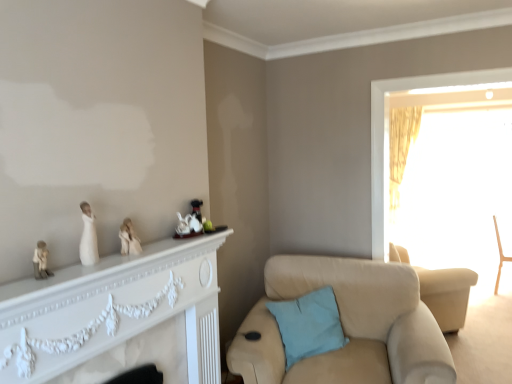
The width and height of the screenshot is (512, 384). Describe the element at coordinates (129, 239) in the screenshot. I see `white porcelain figurine at center, marked as the 1th person in a right-to-left arrangement` at that location.

This screenshot has width=512, height=384. What do you see at coordinates (347, 326) in the screenshot?
I see `beige fabric couch at lower right, positioned as the first chair in front-to-back order` at bounding box center [347, 326].

What do you see at coordinates (113, 310) in the screenshot? The image size is (512, 384). I see `white carved fireplace at upper left` at bounding box center [113, 310].

This screenshot has height=384, width=512. What do you see at coordinates (309, 325) in the screenshot? I see `light blue fabric pillow at lower center` at bounding box center [309, 325].

Describe the element at coordinates (41, 261) in the screenshot. The width and height of the screenshot is (512, 384). I see `white matte figurine at left, the third toy when ordered from back to front` at that location.

This screenshot has height=384, width=512. What do you see at coordinates (388, 137) in the screenshot?
I see `translucent yellow curtain at right` at bounding box center [388, 137].

In order to face translucent yellow curtain at right, should I rotate leftwards or rightwards?

Rotate your view right by about 23.419°.

The width and height of the screenshot is (512, 384). In order to click on white porcelain figurine at center, placed as the 1th person when sorted from back to front in this screenshot , I will do `click(129, 239)`.

Is beige fabric couch at lower right, which is the 2th chair in right-to-left order, oriented away from white carved fireplace at upper left?

No, beige fabric couch at lower right, which is the 2th chair in right-to-left order, is not facing the opposite direction of white carved fireplace at upper left.

Does beige fabric couch at lower right, which is the 2th chair in right-to-left order, lie in front of white carved fireplace at upper left?

No, beige fabric couch at lower right, which is the 2th chair in right-to-left order, is behind white carved fireplace at upper left.

Is beige fabric couch at lower right, placed as the 1th chair when sorted from left to right, surrounding white carved fireplace at upper left?

No, white carved fireplace at upper left is not surrounded by beige fabric couch at lower right, placed as the 1th chair when sorted from left to right.

Is beige fabric couch at lower right, which is the 2th chair in right-to-left order, wider than white carved fireplace at upper left?

Yes.

Can you tell me how much white porcelain figurine at center, marked as the 1th person in a right-to-left arrangement, and light blue fabric pillow at lower center differ in facing direction?

The angular difference between white porcelain figurine at center, marked as the 1th person in a right-to-left arrangement, and light blue fabric pillow at lower center is 40.7 degrees.

Is white porcelain figurine at center, marked as the 1th person in a right-to-left arrangement, placed right next to light blue fabric pillow at lower center?

No, white porcelain figurine at center, marked as the 1th person in a right-to-left arrangement, is not in contact with light blue fabric pillow at lower center.

Consider the image. Does white porcelain figurine at center, which is counted as the second person, starting from the left, appear on the right side of light blue fabric pillow at lower center?

In fact, white porcelain figurine at center, which is counted as the second person, starting from the left, is to the left of light blue fabric pillow at lower center.

From the picture: Choose the correct answer: Is light blue fabric pillow at lower center inside beige fabric couch at lower right, placed as the 1th chair when sorted from left to right, or outside it?

light blue fabric pillow at lower center fits inside beige fabric couch at lower right, placed as the 1th chair when sorted from left to right.

Is light blue fabric pillow at lower center wider than beige fabric couch at lower right, placed as the 1th chair when sorted from left to right?

No.

Can you confirm if light blue fabric pillow at lower center is bigger than beige fabric couch at lower right, positioned as the 2th chair in back-to-front order?

No, light blue fabric pillow at lower center is not bigger than beige fabric couch at lower right, positioned as the 2th chair in back-to-front order.

Does point (341, 336) come farther from viewer compared to point (364, 312)?

No, it is in front of (364, 312).

Can you tell me how much translucent yellow curtain at right and beige fabric couch at lower right, which is the 2th chair in right-to-left order, differ in facing direction?

There is a 15.8-degree angle between the facing directions of translucent yellow curtain at right and beige fabric couch at lower right, which is the 2th chair in right-to-left order.

Which is less distant, [373,255] or [270,337]?

Clearly, point [373,255] is more distant from the camera than point [270,337].

From a real-world perspective, which is physically above, translucent yellow curtain at right or beige fabric couch at lower right, positioned as the 2th chair in back-to-front order?

translucent yellow curtain at right is physically above.

Is translucent yellow curtain at right taller than beige fabric couch at lower right, positioned as the 2th chair in back-to-front order?

Indeed, translucent yellow curtain at right has a greater height compared to beige fabric couch at lower right, positioned as the 2th chair in back-to-front order.

Is translucent yellow curtain at right located outside gold textured curtain at right?

Yes, translucent yellow curtain at right is located beyond the bounds of gold textured curtain at right.

Between translucent yellow curtain at right and gold textured curtain at right, which one is positioned behind?

gold textured curtain at right is more distant.

Considering the points (497, 241) and (383, 236), which point is in front, point (497, 241) or point (383, 236)?

Point (383, 236)

Is the depth of wooden chair at right, placed as the 1th chair when sorted from right to left, less than that of translucent yellow curtain at right?

No.

Who is shorter, wooden chair at right, placed as the 1th chair when sorted from right to left, or translucent yellow curtain at right?

wooden chair at right, placed as the 1th chair when sorted from right to left.

Is translucent yellow curtain at right not inside white matte figurine at left, the third toy when ordered from back to front?

Yes.

Considering the relative sizes of translucent yellow curtain at right and white matte figurine at left, placed as the first toy when sorted from front to back, in the image provided, is translucent yellow curtain at right shorter than white matte figurine at left, placed as the first toy when sorted from front to back,?

No, translucent yellow curtain at right is not shorter than white matte figurine at left, placed as the first toy when sorted from front to back.

Considering the sizes of objects translucent yellow curtain at right and white matte figurine at left, placed as the first toy when sorted from front to back, in the image provided, who is smaller, translucent yellow curtain at right or white matte figurine at left, placed as the first toy when sorted from front to back,?

With smaller size is white matte figurine at left, placed as the first toy when sorted from front to back.

Locate an element on the screen. The height and width of the screenshot is (384, 512). dresser that appears in front of the beige fabric couch at lower right, which is the 2th chair in right-to-left order is located at coordinates (113, 310).

The height and width of the screenshot is (384, 512). I want to click on pillow to the right of white porcelain figurine at center, which is the second person in front-to-back order, so click(x=309, y=325).

Consider the image. Estimate the real-world distances between objects in this image. Which object is closer to translucent yellow curtain at right, wooden chair at right, placed as the 1th chair when sorted from right to left, or white porcelain figurine at center, which is counted as the second person, starting from the left?

white porcelain figurine at center, which is counted as the second person, starting from the left, is positioned closer to the anchor translucent yellow curtain at right.

Looking at the image, which one is located closer to light blue fabric pillow at lower center, white porcelain figurine at center, which is counted as the second person, starting from the left, or gold textured curtain at right?

white porcelain figurine at center, which is counted as the second person, starting from the left, lies closer to light blue fabric pillow at lower center than the other object.

Estimate the real-world distances between objects in this image. Which object is closer to white porcelain teapot at center, which is counted as the 2th toy, starting from the back, beige fabric couch at lower right, positioned as the 2th chair in back-to-front order, or white matte figurine at left, marked as the 1th toy in a left-to-right arrangement?

The object closer to white porcelain teapot at center, which is counted as the 2th toy, starting from the back, is white matte figurine at left, marked as the 1th toy in a left-to-right arrangement.

Estimate the real-world distances between objects in this image. Which object is further from white matte figurine at left, the third toy when ordered from back to front, white porcelain figurine at left, which appears as the first person when viewed from the left, or wooden chair at right, placed as the first chair when sorted from back to front?

wooden chair at right, placed as the first chair when sorted from back to front.

When comparing their distances from gold textured curtain at right, does white carved fireplace at upper left or white porcelain figurine at center, which is the second person in front-to-back order, seem closer?

Among the two, white carved fireplace at upper left is located nearer to gold textured curtain at right.

When comparing their distances from white porcelain teapot at center, which ranks as the second toy in front-to-back order, does wooden chair at right, marked as the 2th chair in a front-to-back arrangement, or gold textured curtain at right seem closer?

gold textured curtain at right.

When comparing their distances from white porcelain teapot at center, which is counted as the 2th toy, starting from the back, does gold textured curtain at right or white carved fireplace at upper left seem closer?

Among the two, white carved fireplace at upper left is located nearer to white porcelain teapot at center, which is counted as the 2th toy, starting from the back.

Considering their positions, is white porcelain figurine at left, placed as the first person when sorted from front to back, positioned further to white matte figurine at left, which appears as the third toy when viewed from the right, than white carved fireplace at upper left?

white carved fireplace at upper left is further to white matte figurine at left, which appears as the third toy when viewed from the right.

The image size is (512, 384). I want to click on chair between white matte figurine at left, which appears as the third toy when viewed from the right, and wooden chair at right, positioned as the 2th chair in left-to-right order, in the horizontal direction, so click(347, 326).

At what (x,y) coordinates should I click in order to perform the action: click on pillow located between white porcelain figurine at center, placed as the 1th person when sorted from back to front, and translucent yellow curtain at right in the left-right direction. Please return your answer as a coordinate pair (x, y). Image resolution: width=512 pixels, height=384 pixels. Looking at the image, I should click on (309, 325).

Locate an element on the screen. pillow located between white porcelain figurine at center, placed as the 1th person when sorted from back to front, and beige fabric couch at lower right, placed as the 1th chair when sorted from left to right, in the left-right direction is located at coordinates (309, 325).

The width and height of the screenshot is (512, 384). Identify the location of window between white carved fireplace at upper left and wooden chair at right, positioned as the 2th chair in left-to-right order, in the front-back direction. (388, 137).